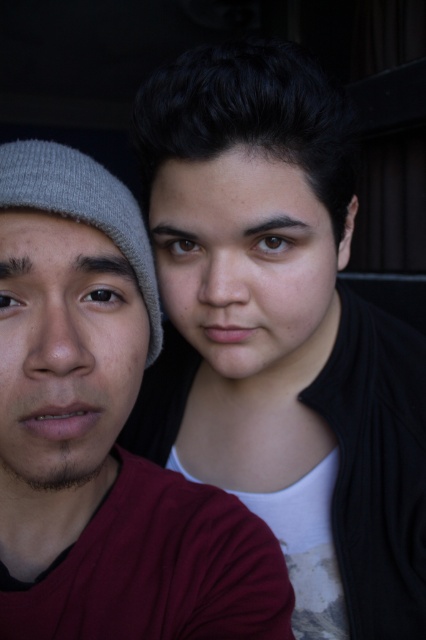
You are taking a selfie with two friends. You want to ensure everyone is in focus. The camera you are using has a depth of field that can cover 25 inches. Is the point at point (348, 582) within the depth of field range?

The distance between point (348, 582) and the camera is 24.67 inches, which is within the camera depth of field range of 25 inches. Therefore, the point at (348, 582) will be in focus.

You are trying to take a selfie with two people. You notice that the matte gray beanie at left and the gray knit beanie at left are overlapping in the photo. Which beanie should you adjust to make sure both are fully visible?

The matte gray beanie at left is in front of the gray knit beanie at left. To ensure both are fully visible, you should adjust the matte gray beanie at left to move it slightly so that it doesn not cover the gray knit beanie at left.

You are taking a photo of two people and need to ensure their headwear fits within the frame. Given that the matte black hair at upper center is taller than the gray knit beanie at left, which headwear should you adjust to avoid being cut off?

The matte black hair at upper center is taller than the gray knit beanie at left, so you should adjust the matte black hair at upper center to ensure it fits within the frame.